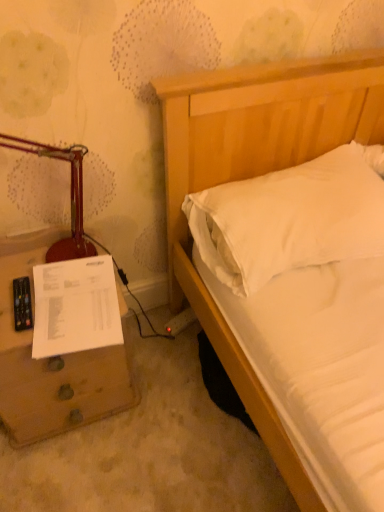
Image resolution: width=384 pixels, height=512 pixels. I want to click on free location to the right of brown wooden nightstand at lower left, so click(165, 398).